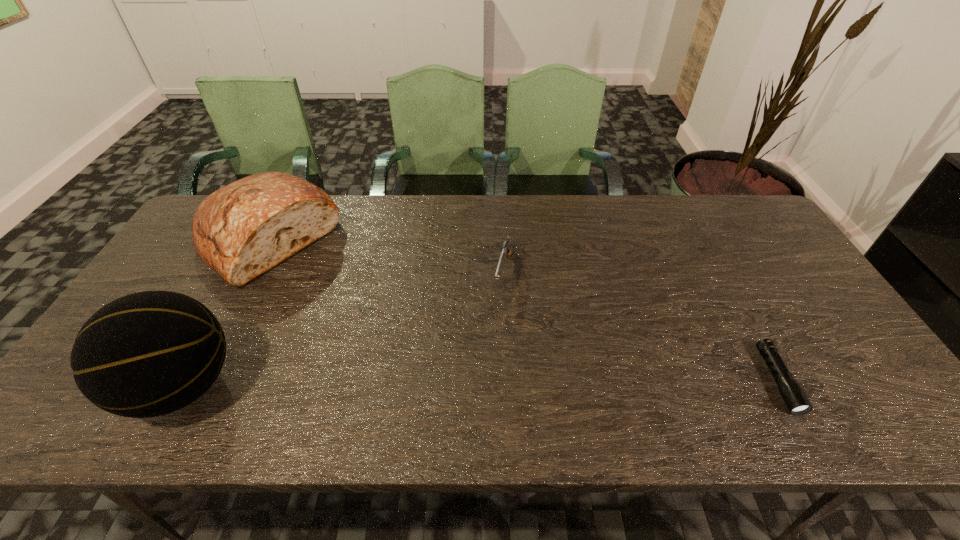
Image resolution: width=960 pixels, height=540 pixels. I want to click on the tallest object, so click(x=147, y=354).

Identify the location of the shortest object. This screenshot has height=540, width=960. (794, 397).

Identify the location of the rightmost object. Image resolution: width=960 pixels, height=540 pixels. (794, 397).

Locate an element on the screen. This screenshot has width=960, height=540. bread is located at coordinates (240, 231).

This screenshot has width=960, height=540. I want to click on the third tallest object, so click(x=506, y=250).

Locate an element on the screen. This screenshot has height=540, width=960. the second object from right to left is located at coordinates (506, 250).

Find the location of a particular element. free region located 0.060m on the left of the basketball is located at coordinates (101, 386).

What are the coordinates of `vacant region located at the sliced front of the bread` in the screenshot? It's located at (318, 288).

In order to click on vacant area situated at the sliced front of the bread in this screenshot , I will do tap(320, 290).

In order to click on free space located 0.280m at the sliced front of the bread in this screenshot , I will do `click(362, 329)`.